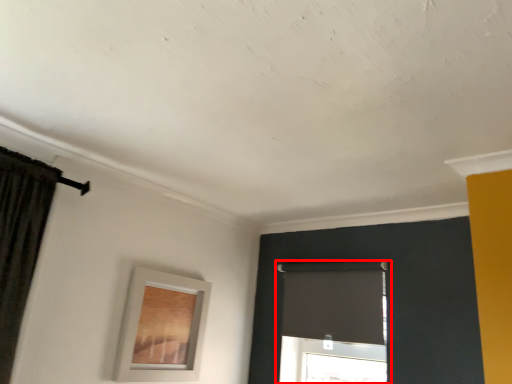
Question: From the image's perspective, what is the correct spatial positioning of window (annotated by the red box) in reference to picture frame?

Choices:
 (A) above
 (B) below

Answer: (A)